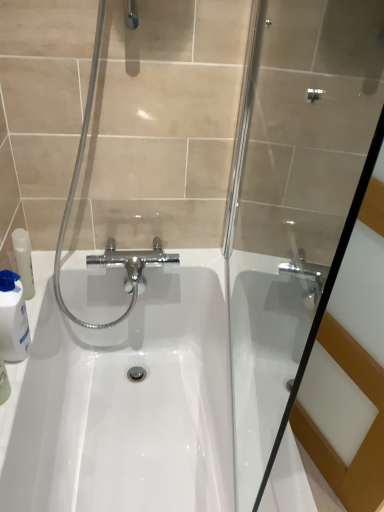
What is the approximate height of transparent glass shower door at center?

transparent glass shower door at center is 35.29 inches in height.

Locate an element on the screen. white glossy sink at center is located at coordinates (124, 401).

Find the location of `transparent glass shower door at center`. transparent glass shower door at center is located at coordinates (293, 197).

Considering the relative positions of white glossy sink at center and white glossy bottle at left in the image provided, is white glossy sink at center in front of white glossy bottle at left?

Yes.

In the scene shown: From a real-world perspective, is white glossy sink at center beneath white glossy bottle at left?

Yes.

Considering the sizes of objects white glossy sink at center and white glossy bottle at left in the image provided, who is thinner, white glossy sink at center or white glossy bottle at left?

Thinner between the two is white glossy bottle at left.

Is white glossy sink at center inside or outside of white glossy bottle at left?

white glossy sink at center is not enclosed by white glossy bottle at left.

Is white glossy bottle at left with white glossy sink at center?

No, white glossy bottle at left is not next to white glossy sink at center.

Image resolution: width=384 pixels, height=512 pixels. I want to click on sink below the white glossy bottle at left (from a real-world perspective), so click(x=124, y=401).

Which of these two, white glossy bottle at left or white glossy sink at center, is bigger?

With larger size is white glossy sink at center.

Is white glossy bottle at left in front of white glossy sink at center?

No.

Considering the sizes of transparent glass shower door at center and white glossy bottle at left in the image, is transparent glass shower door at center wider or thinner than white glossy bottle at left?

transparent glass shower door at center is thinner than white glossy bottle at left.

Measure the distance between transparent glass shower door at center and white glossy bottle at left.

The distance of transparent glass shower door at center from white glossy bottle at left is 30.69 inches.

Considering the points (341, 22) and (0, 345), which point is behind, point (341, 22) or point (0, 345)?

The point (341, 22) is farther.

Image resolution: width=384 pixels, height=512 pixels. Find the location of `shower door in front of the white glossy bottle at left`. shower door in front of the white glossy bottle at left is located at coordinates (293, 197).

From the image's perspective, does transparent glass shower door at center appear higher than white glossy sink at center?

Correct, transparent glass shower door at center appears higher than white glossy sink at center in the image.

Can you confirm if transparent glass shower door at center is smaller than white glossy sink at center?

Indeed, transparent glass shower door at center has a smaller size compared to white glossy sink at center.

Considering the sizes of objects transparent glass shower door at center and white glossy sink at center in the image provided, who is wider, transparent glass shower door at center or white glossy sink at center?

With larger width is white glossy sink at center.

Is white glossy sink at center facing away from transparent glass shower door at center?

That's not correct — white glossy sink at center is not looking away from transparent glass shower door at center.

From the image's perspective, is white glossy sink at center over transparent glass shower door at center?

No.

In the scene shown: Can you tell me how much white glossy sink at center and transparent glass shower door at center differ in facing direction?

9.48 degrees separate the facing orientations of white glossy sink at center and transparent glass shower door at center.

Based on the photo, could you tell me if white glossy bottle at left is turned towards transparent glass shower door at center?

Yes, white glossy bottle at left is aimed at transparent glass shower door at center.

From the image's perspective, is white glossy bottle at left located beneath transparent glass shower door at center?

Yes, from the image's perspective, white glossy bottle at left is below transparent glass shower door at center.

Is white glossy bottle at left not within transparent glass shower door at center?

Absolutely, white glossy bottle at left is external to transparent glass shower door at center.

This screenshot has width=384, height=512. Find the location of `sink on the right of the white glossy bottle at left`. sink on the right of the white glossy bottle at left is located at coordinates (124, 401).

Locate an element on the screen. cleaning product that appears above the white glossy sink at center (from the image's perspective) is located at coordinates (13, 318).

Which object lies further to the anchor point white glossy bottle at left, transparent glass shower door at center or white glossy sink at center?

transparent glass shower door at center is positioned further to the anchor white glossy bottle at left.

Estimate the real-world distances between objects in this image. Which object is further from transparent glass shower door at center, white glossy bottle at left or white glossy sink at center?

white glossy bottle at left lies further to transparent glass shower door at center than the other object.

Which object lies nearer to the anchor point white glossy bottle at left, white glossy sink at center or transparent glass shower door at center?

white glossy sink at center.

Based on their spatial positions, is transparent glass shower door at center or white glossy bottle at left closer to white glossy sink at center?

transparent glass shower door at center.

From the image, which object appears to be farther from white glossy sink at center, white glossy bottle at left or transparent glass shower door at center?

white glossy bottle at left lies further to white glossy sink at center than the other object.

From the image, which object appears to be farther from transparent glass shower door at center, white glossy sink at center or white glossy bottle at left?

The object further to transparent glass shower door at center is white glossy bottle at left.

This screenshot has width=384, height=512. I want to click on sink between transparent glass shower door at center and white glossy bottle at left from front to back, so click(x=124, y=401).